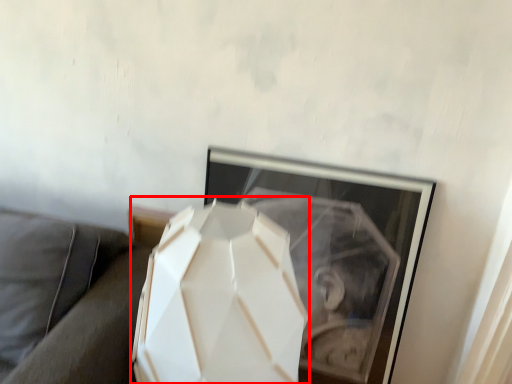
Question: From the image's perspective, what is the correct spatial relationship of lamp (annotated by the red box) in relation to couch?

Choices:
 (A) above
 (B) below

Answer: (A)